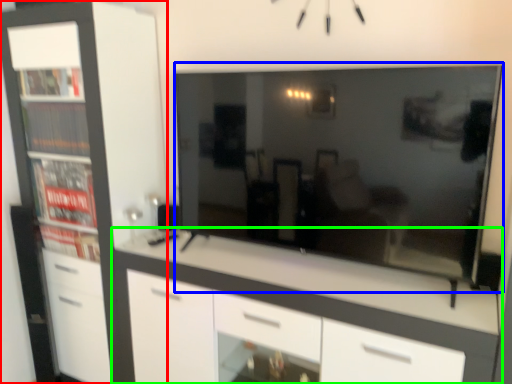
Question: Which object is positioned farthest from cabinetry (highlighted by a red box)? Select from television (highlighted by a blue box) and chest of drawers (highlighted by a green box).

Choices:
 (A) television
 (B) chest of drawers

Answer: (A)